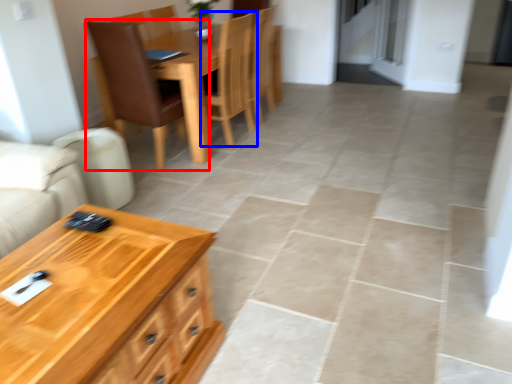
Question: Which of the following is the farthest to the observer, chair (highlighted by a red box) or chair (highlighted by a blue box)?

Choices:
 (A) chair
 (B) chair

Answer: (B)